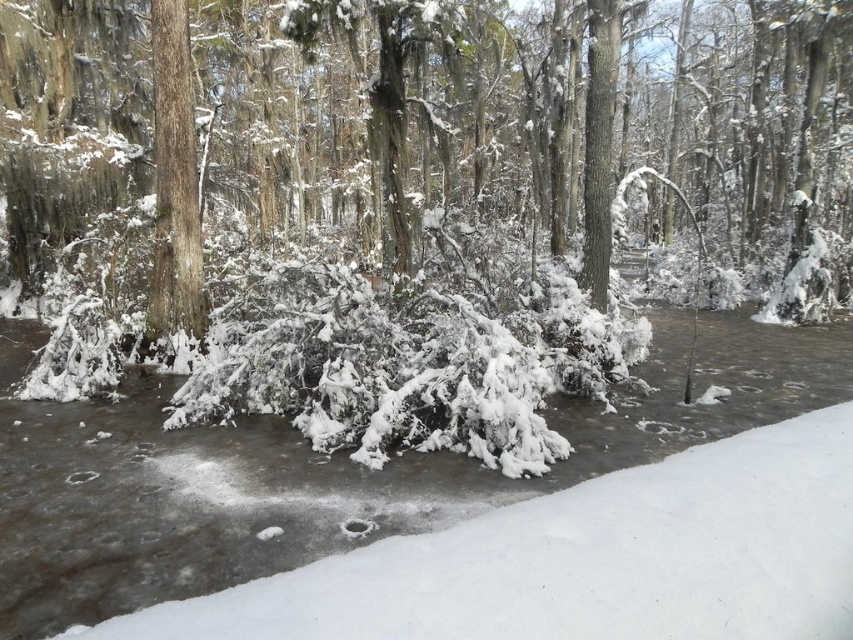
Based on the photo, you are an explorer trying to cross the white frosted stream at center. There is a smooth bark tree at center nearby. Can you use the tree to help cross the stream safely?

The white frosted stream at center might be wider than the smooth bark tree at center, so the tree may not be long enough to bridge the stream. You should look for a longer object to use as a bridge.

You are a hiker who wants to cross the stream using a 4.0 meter long wooden plank. The stream is partially frozen, but you need to ensure the plank can span the distance between the white frosted stream at center and the smooth bark tree at center. Can you safely place the plank there?

The distance between the white frosted stream at center and the smooth bark tree at center is 3.80 meters. Since the plank is 4.0 meters long, it will span the gap comfortably, allowing you to safely cross.

You are standing at the edge of the forest and want to cross to the other side. You see the white frosted stream at center and the smooth bark tree at center. Which object is closer to you, and would it be safer to step onto the stream or avoid it based on its condition?

The white frosted stream at center is closer to the viewer than the smooth bark tree at center. However, the stream is partially frozen with patches of ice, so it might not be safe to step on it. It would be safer to avoid the stream and look for another path.